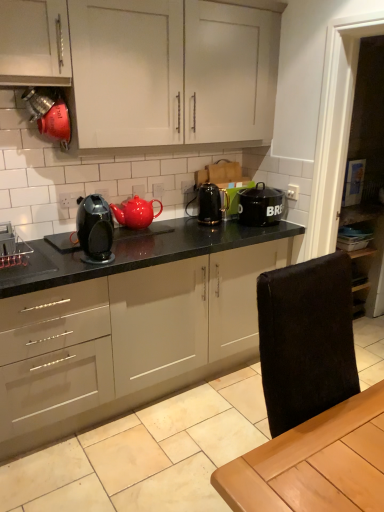
This screenshot has width=384, height=512. Describe the element at coordinates (131, 327) in the screenshot. I see `black granite countertop at center` at that location.

Locate an element on the screen. Image resolution: width=384 pixels, height=512 pixels. black glossy electric kettle at center, marked as the first appliance in a back-to-front arrangement is located at coordinates (211, 204).

Identify the location of brushed metal spice rack at left, which is counted as the first appliance, starting from the front. This screenshot has width=384, height=512. (12, 247).

Locate an element on the screen. The height and width of the screenshot is (512, 384). matte black coffee maker at center is located at coordinates (95, 227).

Find the location of `black granite countertop at center`. black granite countertop at center is located at coordinates (131, 327).

Is white matte cabinet at upper center bigger or smaller than brushed metal spice rack at left, which is counted as the first appliance, starting from the front?

white matte cabinet at upper center is bigger than brushed metal spice rack at left, which is counted as the first appliance, starting from the front.

Is white matte cabinet at upper center looking in the opposite direction of brushed metal spice rack at left, which is counted as the first appliance, starting from the front?

white matte cabinet at upper center does not have its back to brushed metal spice rack at left, which is counted as the first appliance, starting from the front.

From the image's perspective, which object appears higher, white matte cabinet at upper center or brushed metal spice rack at left, which ranks as the first appliance in left-to-right order?

white matte cabinet at upper center appears higher in the image.

Does point (103, 239) lie behind point (17, 246)?

No.

Looking at this image, which object is closer to the camera, matte black coffee maker at center or brushed metal spice rack at left, the second appliance from the top?

Positioned in front is matte black coffee maker at center.

Is matte black coffee maker at center next to brushed metal spice rack at left, which ranks as the 1th appliance in bottom-to-top order?

No, matte black coffee maker at center is not touching brushed metal spice rack at left, which ranks as the 1th appliance in bottom-to-top order.

Is matte black coffee maker at center bigger or smaller than brushed metal spice rack at left, marked as the second appliance in a right-to-left arrangement?

Clearly, matte black coffee maker at center is larger in size than brushed metal spice rack at left, marked as the second appliance in a right-to-left arrangement.

Between black granite countertop at center and white matte cabinet at upper center, which one has less height?

white matte cabinet at upper center.

Between black granite countertop at center and white matte cabinet at upper center, which one appears on the left side from the viewer's perspective?

From the viewer's perspective, black granite countertop at center appears more on the left side.

From the image's perspective, who appears lower, black granite countertop at center or white matte cabinet at upper center?

black granite countertop at center appears lower in the image.

Which object is more forward, glossy ceramic teapot at center, which is counted as the second kitchen appliance, starting from the right, or black matte pot at center, the 2th kitchen appliance positioned from the left?

glossy ceramic teapot at center, which is counted as the second kitchen appliance, starting from the right, is in front.

From the image's perspective, would you say glossy ceramic teapot at center, which is counted as the second kitchen appliance, starting from the right, is shown under black matte pot at center, placed as the first kitchen appliance when sorted from right to left?

Indeed, from the image's perspective, glossy ceramic teapot at center, which is counted as the second kitchen appliance, starting from the right, is shown beneath black matte pot at center, placed as the first kitchen appliance when sorted from right to left.

Is glossy ceramic teapot at center, which is counted as the second kitchen appliance, starting from the right, aimed at black matte pot at center, placed as the first kitchen appliance when sorted from right to left?

No, glossy ceramic teapot at center, which is counted as the second kitchen appliance, starting from the right, is not oriented towards black matte pot at center, placed as the first kitchen appliance when sorted from right to left.

From a real-world perspective, is glossy ceramic teapot at center, the first kitchen appliance in the left-to-right sequence, positioned above or below black matte pot at center, the 2th kitchen appliance positioned from the left?

glossy ceramic teapot at center, the first kitchen appliance in the left-to-right sequence, is situated lower than black matte pot at center, the 2th kitchen appliance positioned from the left, in the real world.

Is point (108, 215) farther from camera compared to point (248, 344)?

That is False.

Looking at this image, from the image's perspective, who appears lower, matte black coffee maker at center or black granite countertop at center?

black granite countertop at center.

Is matte black coffee maker at center situated inside black granite countertop at center or outside?

matte black coffee maker at center is not inside black granite countertop at center, it's outside.

How distant is matte black coffee maker at center from black granite countertop at center?

matte black coffee maker at center and black granite countertop at center are 20.82 inches apart from each other.

Between point (213, 214) and point (1, 224), which one is positioned in front?

The point (1, 224) is more forward.

Where is `appliance above the brushed metal spice rack at left, which ranks as the 1th appliance in bottom-to-top order (from the image's perspective)`? The width and height of the screenshot is (384, 512). appliance above the brushed metal spice rack at left, which ranks as the 1th appliance in bottom-to-top order (from the image's perspective) is located at coordinates (211, 204).

Measure the distance from black glossy electric kettle at center, the first appliance viewed from the right, to brushed metal spice rack at left, the second appliance from the top.

black glossy electric kettle at center, the first appliance viewed from the right, is 3.56 feet from brushed metal spice rack at left, the second appliance from the top.

Is the depth of brushed metal spice rack at left, marked as the second appliance in a right-to-left arrangement, less than that of glossy ceramic teapot at center, the first kitchen appliance in the left-to-right sequence?

Yes, it is in front of glossy ceramic teapot at center, the first kitchen appliance in the left-to-right sequence.

How much distance is there between brushed metal spice rack at left, marked as the 2th appliance in a back-to-front arrangement, and glossy ceramic teapot at center, the first kitchen appliance in the left-to-right sequence?

brushed metal spice rack at left, marked as the 2th appliance in a back-to-front arrangement, is 23.09 inches from glossy ceramic teapot at center, the first kitchen appliance in the left-to-right sequence.

How different are the orientations of brushed metal spice rack at left, marked as the second appliance in a right-to-left arrangement, and glossy ceramic teapot at center, which is counted as the second kitchen appliance, starting from the right, in degrees?

There is a 1.27-degree angle between the facing directions of brushed metal spice rack at left, marked as the second appliance in a right-to-left arrangement, and glossy ceramic teapot at center, which is counted as the second kitchen appliance, starting from the right.

Based on their positions, is brushed metal spice rack at left, which is counted as the first appliance, starting from the front, located to the left or right of glossy ceramic teapot at center, the first kitchen appliance in the left-to-right sequence?

brushed metal spice rack at left, which is counted as the first appliance, starting from the front, is to the left of glossy ceramic teapot at center, the first kitchen appliance in the left-to-right sequence.

This screenshot has height=512, width=384. In order to click on cabinetry in front of the brushed metal spice rack at left, which is counted as the first appliance, starting from the front in this screenshot , I will do `click(150, 67)`.

This screenshot has height=512, width=384. I want to click on appliance below the matte black coffee maker at center (from the image's perspective), so click(12, 247).

Based on their spatial positions, is brushed metal spice rack at left, marked as the second appliance in a right-to-left arrangement, or black granite countertop at center further from white matte cabinet at upper center?

brushed metal spice rack at left, marked as the second appliance in a right-to-left arrangement, lies further to white matte cabinet at upper center than the other object.

Which object lies further to the anchor point brushed metal spice rack at left, which ranks as the first appliance in left-to-right order, black granite countertop at center or white matte cabinet at upper center?

white matte cabinet at upper center lies further to brushed metal spice rack at left, which ranks as the first appliance in left-to-right order, than the other object.

Which object lies further to the anchor point brushed metal spice rack at left, marked as the 2th appliance in a back-to-front arrangement, black granite countertop at center or black matte pot at center, the 2th kitchen appliance positioned from the left?

black matte pot at center, the 2th kitchen appliance positioned from the left, is further to brushed metal spice rack at left, marked as the 2th appliance in a back-to-front arrangement.

In the scene shown: Looking at the image, which one is located further to black matte pot at center, the 2th kitchen appliance positioned from the left, brushed metal spice rack at left, which ranks as the 1th appliance in bottom-to-top order, or black granite countertop at center?

The object further to black matte pot at center, the 2th kitchen appliance positioned from the left, is brushed metal spice rack at left, which ranks as the 1th appliance in bottom-to-top order.

From the image, which object appears to be farther from matte black coffee maker at center, black granite countertop at center or white matte cabinet at upper center?

Among the two, white matte cabinet at upper center is located further to matte black coffee maker at center.

Considering their positions, is black granite countertop at center positioned closer to matte black coffee maker at center than black matte pot at center, placed as the first kitchen appliance when sorted from right to left?

Among the two, black granite countertop at center is located nearer to matte black coffee maker at center.

Which object lies further to the anchor point glossy ceramic teapot at center, which is counted as the second kitchen appliance, starting from the right, white matte cabinet at upper center or black matte pot at center, the 2th kitchen appliance positioned from the left?

white matte cabinet at upper center is positioned further to the anchor glossy ceramic teapot at center, which is counted as the second kitchen appliance, starting from the right.

Looking at the image, which one is located further to white matte cabinet at upper center, brushed metal spice rack at left, which ranks as the 1th appliance in bottom-to-top order, or glossy ceramic teapot at center, which is counted as the second kitchen appliance, starting from the right?

brushed metal spice rack at left, which ranks as the 1th appliance in bottom-to-top order, lies further to white matte cabinet at upper center than the other object.

I want to click on home appliance between brushed metal spice rack at left, which ranks as the first appliance in left-to-right order, and black matte pot at center, the 2th kitchen appliance positioned from the left, so pos(95,227).

At what (x,y) coordinates should I click in order to perform the action: click on appliance between matte black coffee maker at center and black matte pot at center, the 2th kitchen appliance positioned from the left, from left to right. Please return your answer as a coordinate pair (x, y). The image size is (384, 512). Looking at the image, I should click on (211, 204).

Find the location of a particular element. This screenshot has width=384, height=512. countertop between matte black coffee maker at center and black matte pot at center, the 2th kitchen appliance positioned from the left, from left to right is located at coordinates (131, 327).

The image size is (384, 512). In order to click on home appliance located between brushed metal spice rack at left, which ranks as the 1th appliance in bottom-to-top order, and black glossy electric kettle at center, which is the second appliance from left to right, in the left-right direction in this screenshot , I will do `click(95, 227)`.